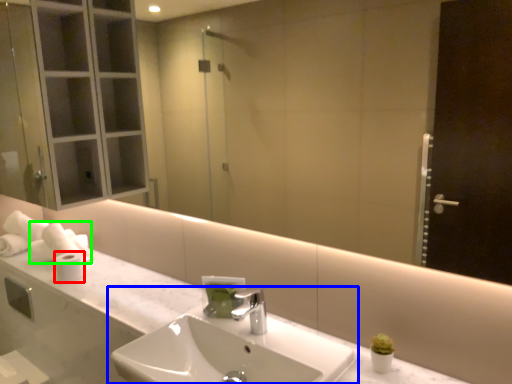
Question: Based on their relative distances, which object is farther from toilet paper (highlighted by a red box)? Choose from sink (highlighted by a blue box) and toilet paper (highlighted by a green box).

Choices:
 (A) sink
 (B) toilet paper

Answer: (A)